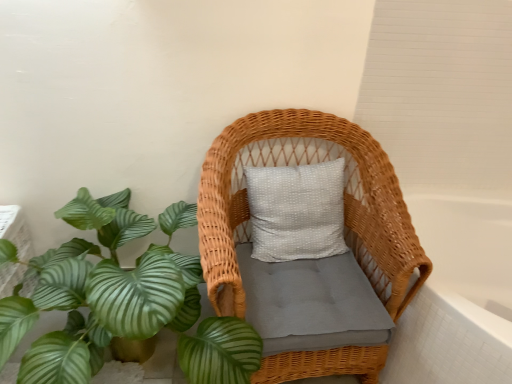
Question: Is white glossy bathtub at right positioned behind woven wicker chair at center?

Choices:
 (A) no
 (B) yes

Answer: (B)

Question: Is white glossy bathtub at right shorter than woven wicker chair at center?

Choices:
 (A) yes
 (B) no

Answer: (A)

Question: Can you confirm if white glossy bathtub at right is positioned to the right of woven wicker chair at center?

Choices:
 (A) no
 (B) yes

Answer: (B)

Question: Is white glossy bathtub at right taller than woven wicker chair at center?

Choices:
 (A) no
 (B) yes

Answer: (A)

Question: From the image's perspective, would you say white glossy bathtub at right is positioned over woven wicker chair at center?

Choices:
 (A) yes
 (B) no

Answer: (B)

Question: From the image's perspective, is green leafy plant at lower left above or below woven wicker chair at center?

Choices:
 (A) below
 (B) above

Answer: (A)

Question: Is point (190, 301) closer or farther from the camera than point (296, 357)?

Choices:
 (A) farther
 (B) closer

Answer: (A)

Question: Relative to woven wicker chair at center, is green leafy plant at lower left in front or behind?

Choices:
 (A) behind
 (B) front

Answer: (B)

Question: Is green leafy plant at lower left bigger or smaller than woven wicker chair at center?

Choices:
 (A) big
 (B) small

Answer: (A)

Question: Considering the positions of white glossy bathtub at right and woven wicker chair at center in the image, is white glossy bathtub at right bigger or smaller than woven wicker chair at center?

Choices:
 (A) big
 (B) small

Answer: (A)

Question: From their relative heights in the image, would you say white glossy bathtub at right is taller or shorter than woven wicker chair at center?

Choices:
 (A) short
 (B) tall

Answer: (A)

Question: Considering the relative positions of white glossy bathtub at right and woven wicker chair at center in the image provided, is white glossy bathtub at right to the left or to the right of woven wicker chair at center?

Choices:
 (A) left
 (B) right

Answer: (B)

Question: Is white glossy bathtub at right spatially inside woven wicker chair at center, or outside of it?

Choices:
 (A) outside
 (B) inside

Answer: (A)

Question: From the image's perspective, is white glossy bathtub at right above or below green leafy plant at lower left?

Choices:
 (A) above
 (B) below

Answer: (B)

Question: Would you say white glossy bathtub at right is inside or outside green leafy plant at lower left?

Choices:
 (A) inside
 (B) outside

Answer: (B)